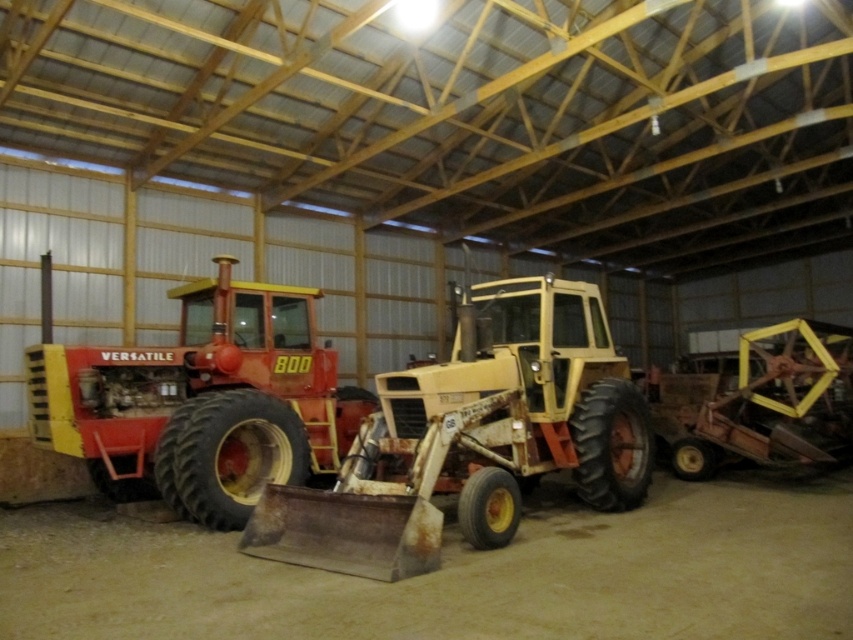
Question: Can you confirm if rusty metal tractor at center is positioned above matte red tractor at left?

Choices:
 (A) yes
 (B) no

Answer: (A)

Question: Which point is farther from the camera taking this photo?

Choices:
 (A) (68, 364)
 (B) (550, 372)

Answer: (B)

Question: Can you confirm if rusty metal tractor at center is smaller than matte red tractor at left?

Choices:
 (A) no
 (B) yes

Answer: (B)

Question: Which of the following is the closest to the observer?

Choices:
 (A) (456, 419)
 (B) (254, 410)

Answer: (A)

Question: Does rusty metal tractor at center have a larger size compared to matte red tractor at left?

Choices:
 (A) yes
 (B) no

Answer: (B)